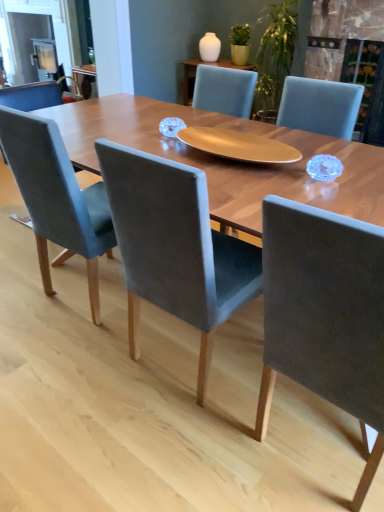
Question: Is suede-like gray chair at center, positioned as the third chair in left-to-right order, far from velvet grey chair at left, acting as the 3th chair starting from the right?

Choices:
 (A) yes
 (B) no

Answer: (A)

Question: Is suede-like gray chair at center, positioned as the third chair in left-to-right order, with velvet grey chair at left, the 1th chair when ordered from left to right?

Choices:
 (A) no
 (B) yes

Answer: (A)

Question: Is suede-like gray chair at center, positioned as the third chair in left-to-right order, bigger than velvet grey chair at left, the 1th chair when ordered from left to right?

Choices:
 (A) yes
 (B) no

Answer: (B)

Question: Is the depth of suede-like gray chair at center, the 1th chair in the right-to-left sequence, less than that of velvet grey chair at left, acting as the 3th chair starting from the right?

Choices:
 (A) yes
 (B) no

Answer: (A)

Question: Is suede-like gray chair at center, the 1th chair in the right-to-left sequence, not inside velvet grey chair at left, acting as the 3th chair starting from the right?

Choices:
 (A) yes
 (B) no

Answer: (A)

Question: Looking at their shapes, would you say velvet grey chair at left, acting as the 3th chair starting from the right, is wider or thinner than velvet grey chair at center, marked as the second chair in a left-to-right arrangement?

Choices:
 (A) wide
 (B) thin

Answer: (A)

Question: Relative to velvet grey chair at center, marked as the second chair in a left-to-right arrangement, is velvet grey chair at left, the 1th chair when ordered from left to right, in front or behind?

Choices:
 (A) behind
 (B) front

Answer: (A)

Question: Considering the positions of velvet grey chair at left, the 1th chair when ordered from left to right, and velvet grey chair at center, marked as the second chair in a right-to-left arrangement, in the image, is velvet grey chair at left, the 1th chair when ordered from left to right, bigger or smaller than velvet grey chair at center, marked as the second chair in a right-to-left arrangement,?

Choices:
 (A) big
 (B) small

Answer: (A)

Question: From their relative heights in the image, would you say velvet grey chair at left, the 1th chair when ordered from left to right, is taller or shorter than velvet grey chair at center, marked as the second chair in a right-to-left arrangement?

Choices:
 (A) short
 (B) tall

Answer: (B)

Question: In the image, is velvet grey chair at center, marked as the second chair in a right-to-left arrangement, positioned in front of or behind suede-like gray chair at center, positioned as the third chair in left-to-right order?

Choices:
 (A) behind
 (B) front

Answer: (A)

Question: Would you say velvet grey chair at center, marked as the second chair in a left-to-right arrangement, is inside or outside suede-like gray chair at center, positioned as the third chair in left-to-right order?

Choices:
 (A) inside
 (B) outside

Answer: (B)

Question: From their relative heights in the image, would you say velvet grey chair at center, marked as the second chair in a left-to-right arrangement, is taller or shorter than suede-like gray chair at center, the 1th chair in the right-to-left sequence?

Choices:
 (A) short
 (B) tall

Answer: (B)

Question: Considering the positions of point (142, 241) and point (279, 303), is point (142, 241) closer or farther from the camera than point (279, 303)?

Choices:
 (A) farther
 (B) closer

Answer: (A)

Question: From a real-world perspective, is suede-like gray chair at center, the 1th chair in the right-to-left sequence, physically located above or below velvet grey chair at left, the 1th chair when ordered from left to right?

Choices:
 (A) above
 (B) below

Answer: (B)

Question: Is suede-like gray chair at center, positioned as the third chair in left-to-right order, taller or shorter than velvet grey chair at left, the 1th chair when ordered from left to right?

Choices:
 (A) tall
 (B) short

Answer: (B)